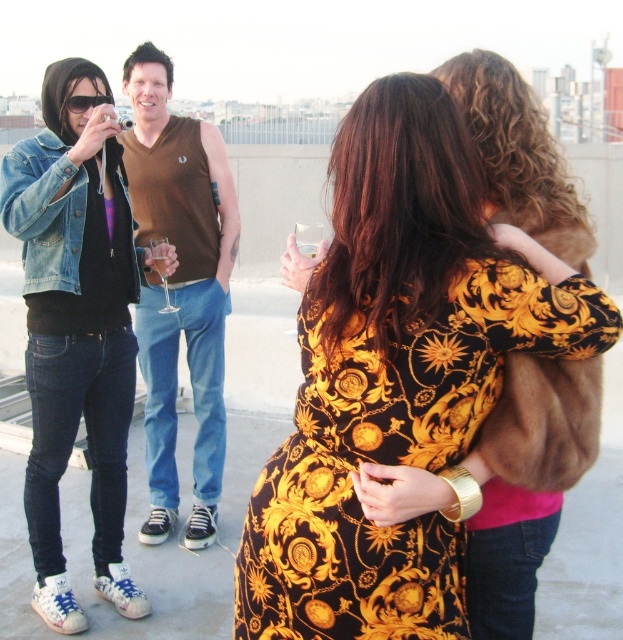
You are a photographer at the rooftop gathering. You want to ensure that both the denim jacket at left and the brown sleeveless shirt at center are visible in your photo. Which clothing item should you focus on first to frame the shot properly?

The denim jacket at left has a lesser height compared to the brown sleeveless shirt at center, so you should focus on framing the denim jacket at left first to ensure both are visible in the photo.

You are standing at the point marked as point (117, 474) on the rooftop and want to take a photo of the city skyline. If you need to be at least 3 meters away from the edge to avoid falling, is your current position safe?

The distance between point (117, 474) and the viewer is 3.37 meters. Since the required distance is at least 3 meters, your current position is safe as it exceeds the minimum safety distance.